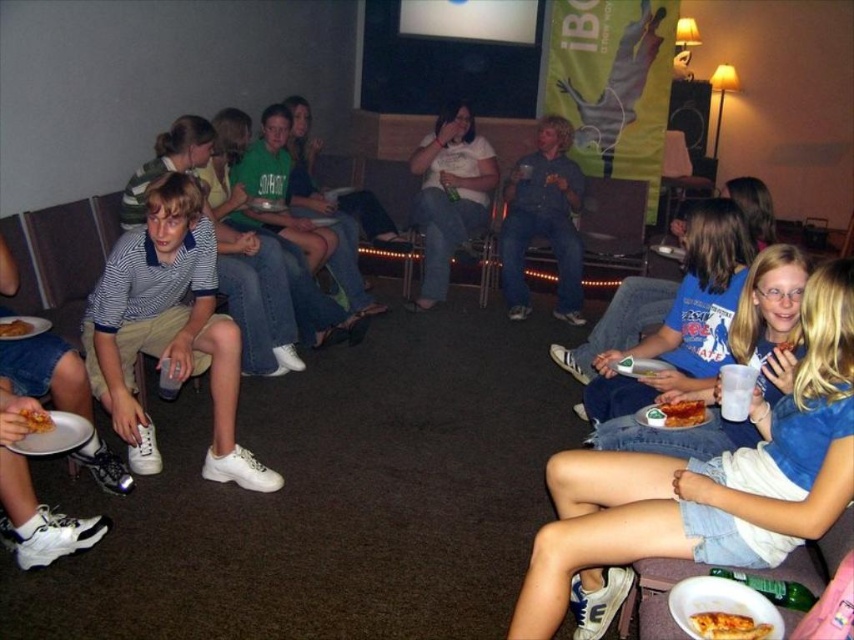
Question: Is tomato sauce pizza at lower right positioned before golden crispy chicken at lower left?

Choices:
 (A) no
 (B) yes

Answer: (A)

Question: Can you confirm if denim jeans at center is thinner than tomato sauce pizza at lower right?

Choices:
 (A) yes
 (B) no

Answer: (B)

Question: Which object is closer to the camera taking this photo?

Choices:
 (A) denim shorts at lower right
 (B) white matte shirt at center
 (C) denim jeans at center

Answer: (A)

Question: Considering the relative positions of white matte shirt at center and green glass bottle at lower right in the image provided, where is white matte shirt at center located with respect to green glass bottle at lower right?

Choices:
 (A) left
 (B) right

Answer: (A)

Question: Which point is farther to the camera?

Choices:
 (A) white matte shirt at center
 (B) golden crispy pizza slice at lower right

Answer: (A)

Question: Which is farther from the golden crispy pizza slice at lower left?

Choices:
 (A) white matte shirt at center
 (B) denim jeans at center
 (C) golden crispy chicken at lower left

Answer: (B)